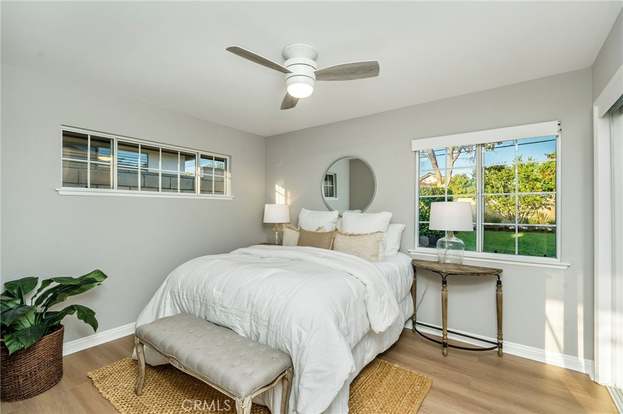
The image size is (623, 414). Find the location of `pillows`. pillows is located at coordinates (293, 237), (316, 218), (311, 237), (352, 221), (362, 249), (392, 242).